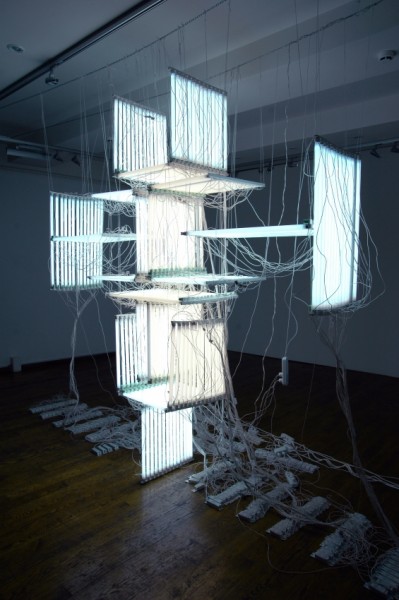
Identify the location of track lighting. The image size is (399, 600). (98, 33), (377, 145).